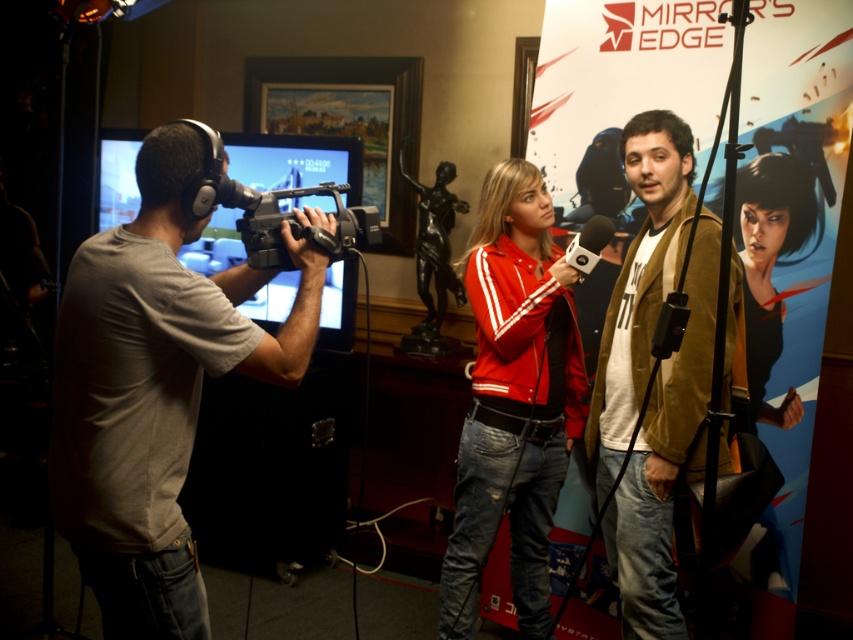
Between gray fabric shirt at left and black matte video camera at center, which one is positioned lower?

gray fabric shirt at left is lower down.

Is gray fabric shirt at left further to the viewer compared to black matte video camera at center?

No, it is in front of black matte video camera at center.

Is point (109, 314) farther from camera compared to point (263, 193)?

No.

Locate an element on the screen. gray fabric shirt at left is located at coordinates (154, 390).

Measure the distance between matte red jacket at center and camera.

matte red jacket at center and camera are 7.51 feet apart from each other.

Which is in front, point (511, 269) or point (647, 568)?

Point (647, 568) is in front.

Who is more forward, (490,428) or (695,438)?

Point (695,438) is in front.

What are the coordinates of `matte red jacket at center` in the screenshot? It's located at (514, 397).

In the scene shown: Does blue glossy poster at center right have a greater width compared to matte red jacket at center?

Indeed, blue glossy poster at center right has a greater width compared to matte red jacket at center.

Between blue glossy poster at center right and matte red jacket at center, which one has more height?

With more height is blue glossy poster at center right.

Does point (798, 164) come closer to viewer compared to point (527, 328)?

No.

Find the location of a particular element. blue glossy poster at center right is located at coordinates (787, 259).